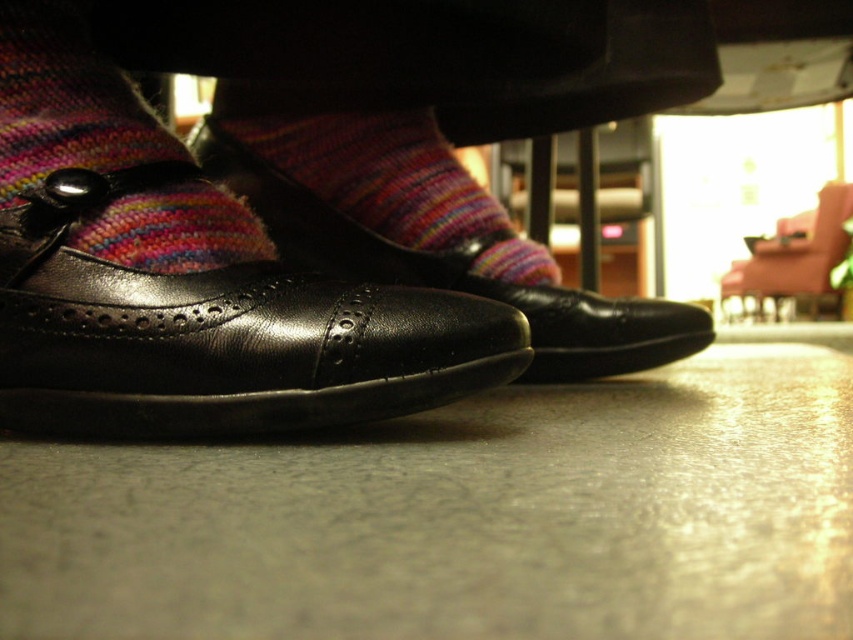
Who is more forward, [70,20] or [456,284]?

Positioned in front is point [70,20].

Identify the location of multicolored knitted sock at lower left. (65, 100).

Does multicolored knitted sock at center have a smaller size compared to multicolored knitted sock at lower left?

Actually, multicolored knitted sock at center might be larger than multicolored knitted sock at lower left.

Between multicolored knitted sock at center and multicolored knitted sock at lower left, which one is positioned lower?

Positioned lower is multicolored knitted sock at lower left.

Who is more distant from viewer, (x=432, y=275) or (x=80, y=88)?

The point (x=432, y=275) is more distant.

Identify the location of multicolored knitted sock at center. (372, 198).

Does point (466, 260) come behind point (827, 243)?

No, (466, 260) is in front of (827, 243).

The image size is (853, 640). Identify the location of black leather shoe at center. (456, 273).